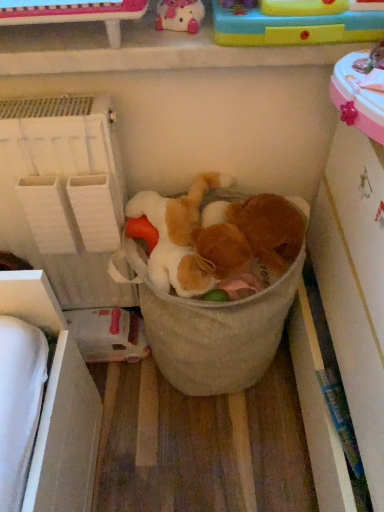
This screenshot has width=384, height=512. What do you see at coordinates (180, 15) in the screenshot?
I see `matte pink plush at upper center, marked as the 1th toy in a top-to-bottom arrangement` at bounding box center [180, 15].

You are a GUI agent. You are given a task and a screenshot of the screen. Output one action in this format:
    pyautogui.click(x=<x>, y=<y>)
    Task: Click on the beige fabric laundry basket at center
    The image size is (384, 512).
    Given the screenshot: What is the action you would take?
    pyautogui.click(x=211, y=329)

Identify the location of white fabric shelf at left. (64, 194).

At what (x,y) coordinates should I click in order to perform the action: click on rubberized plastic toy at upper right, which ranks as the second toy in bottom-to-top order. Please return your answer as a coordinate pair (x, y). The height and width of the screenshot is (512, 384). Looking at the image, I should click on (294, 27).

Identify the location of fluffy brown teddy bear at center. (269, 229).

You are a GUI agent. You are given a task and a screenshot of the screen. Output one action in this format:
    pyautogui.click(x=<x>, y=<y>)
    Task: Click on the laundry basket that appears below the matte pink plush at upper center, which ranks as the third toy in bottom-to-top order (from the image's perspective)
    This screenshot has width=384, height=512.
    Given the screenshot: What is the action you would take?
    (211, 329)

Based on the photo, considering the relative positions of beige fabric laundry basket at center and matte pink plush at upper center, marked as the 1th toy in a top-to-bottom arrangement, in the image provided, is beige fabric laundry basket at center in front of matte pink plush at upper center, marked as the 1th toy in a top-to-bottom arrangement,?

That is False.

Can you confirm if beige fabric laundry basket at center is smaller than matte pink plush at upper center, marked as the 1th toy in a top-to-bottom arrangement?

Result: Incorrect, beige fabric laundry basket at center is not smaller in size than matte pink plush at upper center, marked as the 1th toy in a top-to-bottom arrangement.

How many degrees apart are the facing directions of beige fabric laundry basket at center and matte pink plush at upper center, which ranks as the third toy in bottom-to-top order?

The facing directions of beige fabric laundry basket at center and matte pink plush at upper center, which ranks as the third toy in bottom-to-top order, are 0.696 degrees apart.

Based on their positions, is fluffy brown teddy bear at center located to the left or right of rubberized plastic toy at upper right, which ranks as the second toy in bottom-to-top order?

Clearly, fluffy brown teddy bear at center is on the left of rubberized plastic toy at upper right, which ranks as the second toy in bottom-to-top order, in the image.

Between fluffy brown teddy bear at center and rubberized plastic toy at upper right, which is the 2th toy from top to bottom, which one has larger width?

With larger width is fluffy brown teddy bear at center.

Is rubberized plastic toy at upper right, which is the 2th toy from top to bottom, at the back of fluffy brown teddy bear at center?

No, fluffy brown teddy bear at center is not facing the opposite direction of rubberized plastic toy at upper right, which is the 2th toy from top to bottom.

Does fluffy brown teddy bear at center contain rubberized plastic toy at upper right, which is the 2th toy from top to bottom?

Definitely not — rubberized plastic toy at upper right, which is the 2th toy from top to bottom, is not inside fluffy brown teddy bear at center.

Is rubberized plastic toy at upper right, which ranks as the second toy in bottom-to-top order, shorter than fluffy white teddy bear at center, the 1th toy ordered from the bottom?

Yes, rubberized plastic toy at upper right, which ranks as the second toy in bottom-to-top order, is shorter than fluffy white teddy bear at center, the 1th toy ordered from the bottom.

From a real-world perspective, which is physically above, rubberized plastic toy at upper right, which ranks as the second toy in bottom-to-top order, or fluffy white teddy bear at center, arranged as the 3th toy when viewed from the top?

rubberized plastic toy at upper right, which ranks as the second toy in bottom-to-top order, from a real-world perspective.

I want to click on toy that is the 1st object located above the fluffy white teddy bear at center, the 1th toy ordered from the bottom (from the image's perspective), so click(294, 27).

From the image's perspective, is rubberized plastic toy at upper right, which ranks as the second toy in bottom-to-top order, under fluffy white teddy bear at center, arranged as the 3th toy when viewed from the top?

No, from the image's perspective, rubberized plastic toy at upper right, which ranks as the second toy in bottom-to-top order, is not below fluffy white teddy bear at center, arranged as the 3th toy when viewed from the top.

Find the location of a particular element. laundry basket below the rubberized plastic toy at upper right, which ranks as the second toy in bottom-to-top order (from the image's perspective) is located at coordinates 211,329.

Based on the photo, considering the relative sizes of beige fabric laundry basket at center and rubberized plastic toy at upper right, which ranks as the second toy in bottom-to-top order, in the image provided, is beige fabric laundry basket at center thinner than rubberized plastic toy at upper right, which ranks as the second toy in bottom-to-top order,?

Incorrect, the width of beige fabric laundry basket at center is not less than that of rubberized plastic toy at upper right, which ranks as the second toy in bottom-to-top order.

Considering the relative sizes of beige fabric laundry basket at center and rubberized plastic toy at upper right, which is the 2th toy from top to bottom, in the image provided, is beige fabric laundry basket at center bigger than rubberized plastic toy at upper right, which is the 2th toy from top to bottom,?

Correct, beige fabric laundry basket at center is larger in size than rubberized plastic toy at upper right, which is the 2th toy from top to bottom.

Is beige fabric laundry basket at center spatially inside rubberized plastic toy at upper right, which ranks as the second toy in bottom-to-top order, or outside of it?

beige fabric laundry basket at center lies outside rubberized plastic toy at upper right, which ranks as the second toy in bottom-to-top order.

Looking at this image, could you tell me if beige fabric laundry basket at center is facing white fabric shelf at left?

No, beige fabric laundry basket at center is not facing towards white fabric shelf at left.

Is beige fabric laundry basket at center in contact with white fabric shelf at left?

They are not placed beside each other.

Considering the relative sizes of beige fabric laundry basket at center and white fabric shelf at left in the image provided, is beige fabric laundry basket at center wider than white fabric shelf at left?

Correct, the width of beige fabric laundry basket at center exceeds that of white fabric shelf at left.

Does beige fabric laundry basket at center have a greater height compared to white fabric shelf at left?

No.

Which of these two, fluffy brown teddy bear at center or white fabric shelf at left, is smaller?

With smaller size is fluffy brown teddy bear at center.

From a real-world perspective, is fluffy brown teddy bear at center positioned under white fabric shelf at left based on gravity?

Incorrect, from a real-world perspective, fluffy brown teddy bear at center is higher than white fabric shelf at left.

From the image's perspective, is fluffy brown teddy bear at center located above or below white fabric shelf at left?

Clearly, from the image's perspective, fluffy brown teddy bear at center is below white fabric shelf at left.

Considering the relative positions of fluffy brown teddy bear at center and white fabric shelf at left in the image provided, is fluffy brown teddy bear at center to the right of white fabric shelf at left from the viewer's perspective?

Yes.

Looking at their sizes, would you say fluffy brown teddy bear at center is wider or thinner than fluffy white teddy bear at center, the 1th toy ordered from the bottom?

In the image, fluffy brown teddy bear at center appears to be more narrow than fluffy white teddy bear at center, the 1th toy ordered from the bottom.

Does fluffy brown teddy bear at center lie behind fluffy white teddy bear at center, arranged as the 3th toy when viewed from the top?

No, fluffy brown teddy bear at center is in front of fluffy white teddy bear at center, arranged as the 3th toy when viewed from the top.

Considering the positions of objects fluffy brown teddy bear at center and fluffy white teddy bear at center, arranged as the 3th toy when viewed from the top, in the image provided, who is more to the left, fluffy brown teddy bear at center or fluffy white teddy bear at center, arranged as the 3th toy when viewed from the top,?

fluffy white teddy bear at center, arranged as the 3th toy when viewed from the top.

Locate an element on the screen. The width and height of the screenshot is (384, 512). the 3rd toy above when counting from the beige fabric laundry basket at center (from the image's perspective) is located at coordinates (180, 15).

Identify the location of animal below the rubberized plastic toy at upper right, which is the 2th toy from top to bottom (from a real-world perspective). This screenshot has width=384, height=512. (269, 229).

When comparing their distances from rubberized plastic toy at upper right, which is the 2th toy from top to bottom, does fluffy white teddy bear at center, the 1th toy ordered from the bottom, or white fabric shelf at left seem closer?

fluffy white teddy bear at center, the 1th toy ordered from the bottom.

Looking at the image, which one is located further to fluffy brown teddy bear at center, beige fabric laundry basket at center or white fabric shelf at left?

Among the two, white fabric shelf at left is located further to fluffy brown teddy bear at center.

Considering their positions, is white fabric shelf at left positioned further to matte pink plush at upper center, which ranks as the third toy in bottom-to-top order, than fluffy brown teddy bear at center?

Among the two, white fabric shelf at left is located further to matte pink plush at upper center, which ranks as the third toy in bottom-to-top order.

When comparing their distances from beige fabric laundry basket at center, does fluffy white teddy bear at center, arranged as the 3th toy when viewed from the top, or rubberized plastic toy at upper right, which is the 2th toy from top to bottom, seem further?

rubberized plastic toy at upper right, which is the 2th toy from top to bottom, is further to beige fabric laundry basket at center.

From the image, which object appears to be farther from beige fabric laundry basket at center, fluffy brown teddy bear at center or matte pink plush at upper center, which ranks as the third toy in bottom-to-top order?

Based on the image, matte pink plush at upper center, which ranks as the third toy in bottom-to-top order, appears to be further to beige fabric laundry basket at center.

When comparing their distances from beige fabric laundry basket at center, does rubberized plastic toy at upper right, which is the 2th toy from top to bottom, or fluffy brown teddy bear at center seem further?

rubberized plastic toy at upper right, which is the 2th toy from top to bottom, is positioned further to the anchor beige fabric laundry basket at center.

Consider the image. Looking at the image, which one is located closer to matte pink plush at upper center, which ranks as the third toy in bottom-to-top order, rubberized plastic toy at upper right, which ranks as the second toy in bottom-to-top order, or fluffy white teddy bear at center, the 1th toy ordered from the bottom?

rubberized plastic toy at upper right, which ranks as the second toy in bottom-to-top order, is positioned closer to the anchor matte pink plush at upper center, which ranks as the third toy in bottom-to-top order.

When comparing their distances from fluffy brown teddy bear at center, does fluffy white teddy bear at center, arranged as the 3th toy when viewed from the top, or beige fabric laundry basket at center seem further?

beige fabric laundry basket at center.

Identify the location of shelf between matte pink plush at upper center, marked as the 1th toy in a top-to-bottom arrangement, and fluffy brown teddy bear at center, in the vertical direction. This screenshot has width=384, height=512. (64, 194).

In order to click on shelf between matte pink plush at upper center, which ranks as the third toy in bottom-to-top order, and beige fabric laundry basket at center vertically in this screenshot , I will do `click(64, 194)`.

Locate an element on the screen. Image resolution: width=384 pixels, height=512 pixels. animal between matte pink plush at upper center, which ranks as the third toy in bottom-to-top order, and beige fabric laundry basket at center from top to bottom is located at coordinates (269, 229).

Identify the location of animal located between white fabric shelf at left and rubberized plastic toy at upper right, which is the 2th toy from top to bottom, in the left-right direction. The width and height of the screenshot is (384, 512). (269, 229).